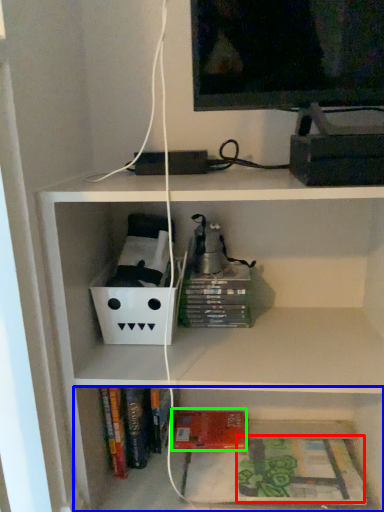
Question: Which object is the closest to the book (highlighted by a red box)? Choose among these: shelf (highlighted by a blue box) or paperback book (highlighted by a green box).

Choices:
 (A) shelf
 (B) paperback book

Answer: (A)